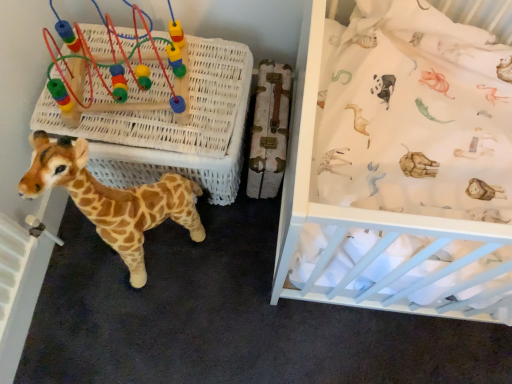
Question: In terms of height, does soft plush giraffe at lower left look taller or shorter compared to white fabric at upper right?

Choices:
 (A) tall
 (B) short

Answer: (B)

Question: Would you say soft plush giraffe at lower left is to the left or to the right of white fabric at upper right in the picture?

Choices:
 (A) left
 (B) right

Answer: (A)

Question: Which of these objects is positioned farthest from the plastic beads at upper left?

Choices:
 (A) white fabric at upper right
 (B) white wicker basket at center
 (C) soft plush giraffe at lower left

Answer: (A)

Question: Which of these objects is positioned farthest from the white wicker basket at center?

Choices:
 (A) soft plush giraffe at lower left
 (B) white fabric at upper right
 (C) plastic beads at upper left

Answer: (B)